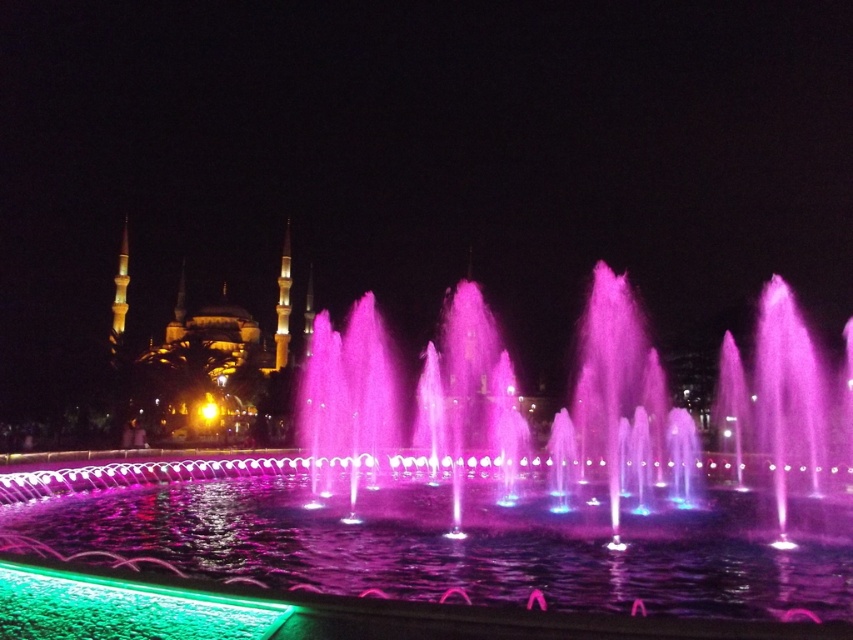
Can you confirm if pink translucent water at center is taller than green glass water at lower left?

Indeed, pink translucent water at center has a greater height compared to green glass water at lower left.

Is point (624, 513) positioned behind point (602, 572)?

That is True.

Identify the location of pink translucent water at center. This screenshot has width=853, height=640. (416, 524).